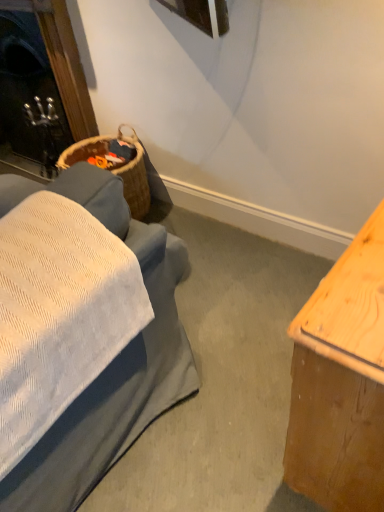
Question: From a real-world perspective, is light brown wood table at right on black glass fireplace at upper left?

Choices:
 (A) no
 (B) yes

Answer: (A)

Question: Can you confirm if light brown wood table at right is smaller than black glass fireplace at upper left?

Choices:
 (A) no
 (B) yes

Answer: (B)

Question: Does light brown wood table at right have a greater width compared to black glass fireplace at upper left?

Choices:
 (A) no
 (B) yes

Answer: (B)

Question: Does light brown wood table at right appear on the right side of black glass fireplace at upper left?

Choices:
 (A) yes
 (B) no

Answer: (A)

Question: From the image's perspective, would you say light brown wood table at right is shown under black glass fireplace at upper left?

Choices:
 (A) yes
 (B) no

Answer: (A)

Question: Considering the relative sizes of light brown wood table at right and black glass fireplace at upper left in the image provided, is light brown wood table at right bigger than black glass fireplace at upper left?

Choices:
 (A) yes
 (B) no

Answer: (B)

Question: Is black glass fireplace at upper left bigger than light brown wood table at right?

Choices:
 (A) no
 (B) yes

Answer: (B)

Question: From the image's perspective, is black glass fireplace at upper left on top of light brown wood table at right?

Choices:
 (A) no
 (B) yes

Answer: (B)

Question: Would you consider black glass fireplace at upper left to be distant from light brown wood table at right?

Choices:
 (A) yes
 (B) no

Answer: (A)

Question: Can you confirm if black glass fireplace at upper left is smaller than light brown wood table at right?

Choices:
 (A) no
 (B) yes

Answer: (A)

Question: Is black glass fireplace at upper left wider than light brown wood table at right?

Choices:
 (A) no
 (B) yes

Answer: (A)

Question: Is light brown wood table at right inside black glass fireplace at upper left?

Choices:
 (A) yes
 (B) no

Answer: (B)

Question: Does point (324, 412) appear closer or farther from the camera than point (91, 129)?

Choices:
 (A) closer
 (B) farther

Answer: (A)